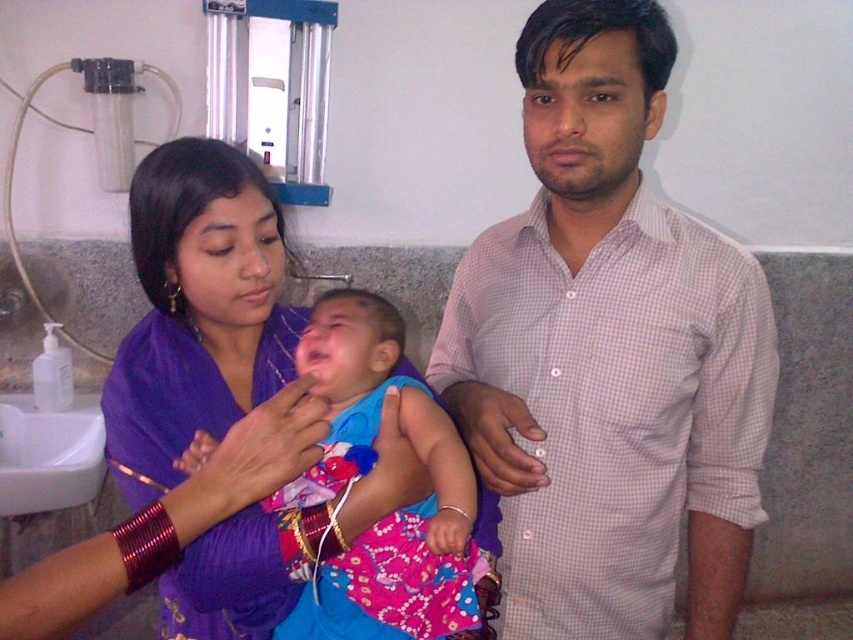
You are a photographer taking a picture of the scene. You notice the pink checkered shirt at center and the purple fabric at center. Which one is positioned higher in the image?

The pink checkered shirt at center is above the purple fabric at center, so it is positioned higher in the image.

You are a photographer setting up for a family photo in the medical facility. You need to ensure that the pink checkered shirt at center and the purple fabric at center are both visible in the frame. Given their sizes, which object should you focus on to ensure both are captured without cropping?

The pink checkered shirt at center is larger in size than purple fabric at center. To ensure both are visible without cropping, focus on the larger pink checkered shirt at center first, then adjust the frame to include the smaller purple fabric at center.

In the scene shown: You are standing in the medical facility and see the point marked at coordinate (x=608, y=355). What object is located at that point?

The pink checkered shirt at center is located at the point marked by coordinate (x=608, y=355).